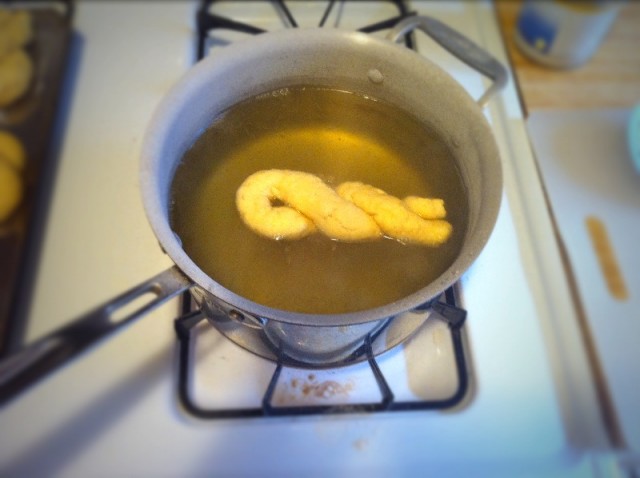
Where is `stovetop`? This screenshot has height=478, width=640. stovetop is located at coordinates pos(509,334).